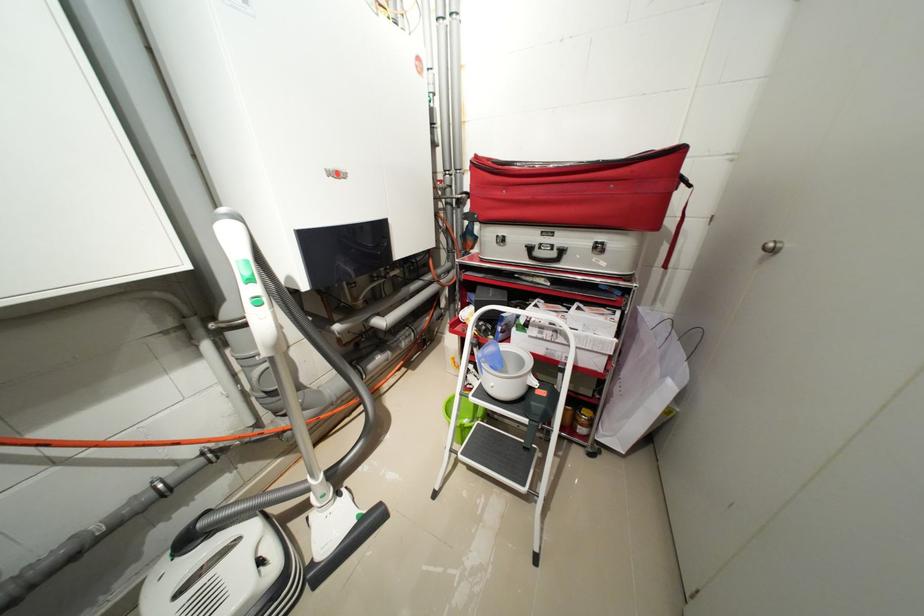
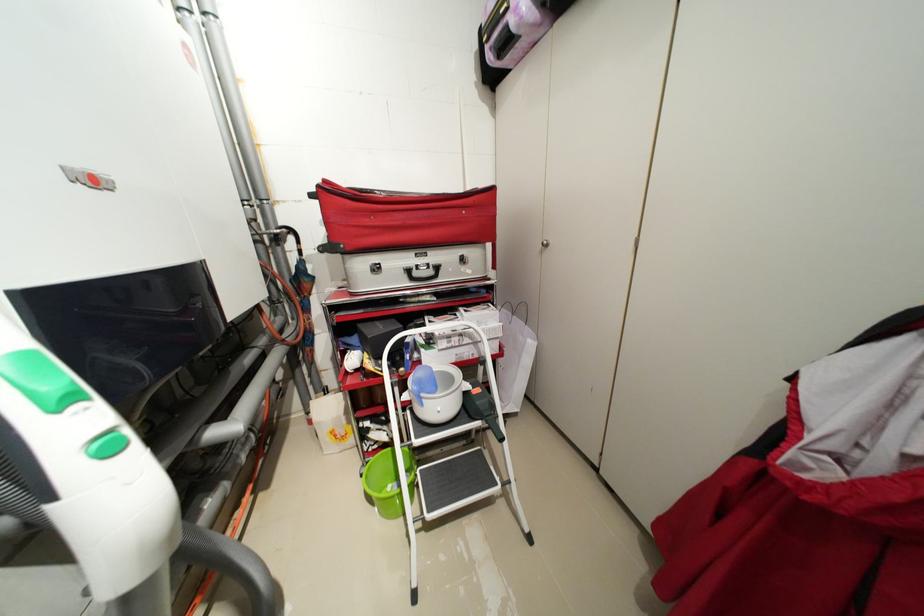
Locate, in the second image, the point that corresponds to point (483, 158) in the first image.

(332, 182)